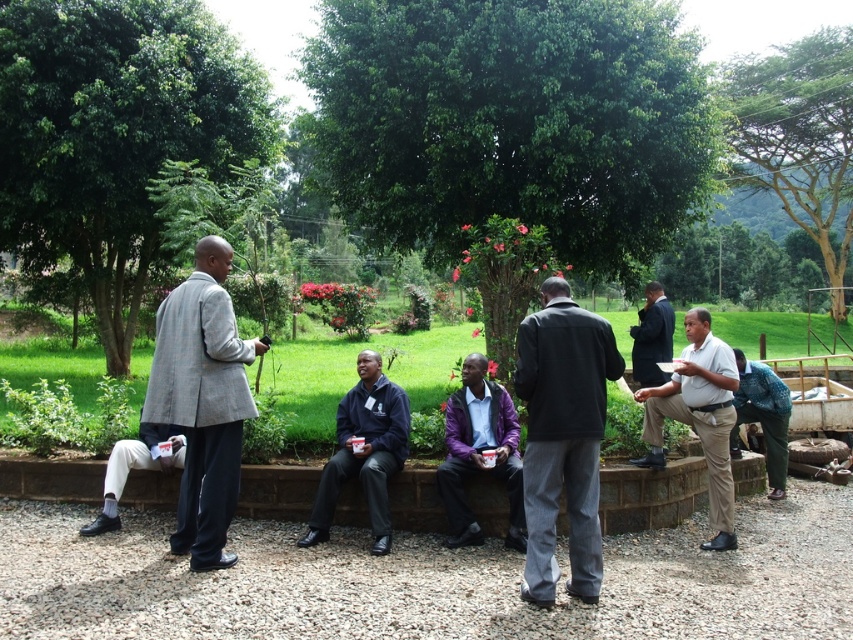
You are standing at the gravel pathway in the park scene. You see two points marked in the image. Which point is nearer to you, point 1 at coordinates (218,456) or point 2 at coordinates (347,438)?

Point 1 at coordinates (218,456) is closer to you than point 2 at coordinates (347,438).

You are a photographer trying to capture a clear shot of the purple matte jacket at center without any obstructions. Given the green leafy tree at upper left is above it, how can you adjust your position to ensure the jacket is visible?

Since the green leafy tree at upper left is positioned over the purple matte jacket at center, you should move your camera angle downward or shift your position to the side to avoid the tree blocking the jacket.

You are a photographer trying to capture a group photo of the people at the park. You want to ensure that both the green leafy tree at upper left and the purple matte jacket at center are visible in the frame. Considering their sizes, which object should you focus on to ensure both are in the shot?

The green leafy tree at upper left is larger than the purple matte jacket at center, so focusing on the tree will help ensure both are in the frame as it occupies more space.